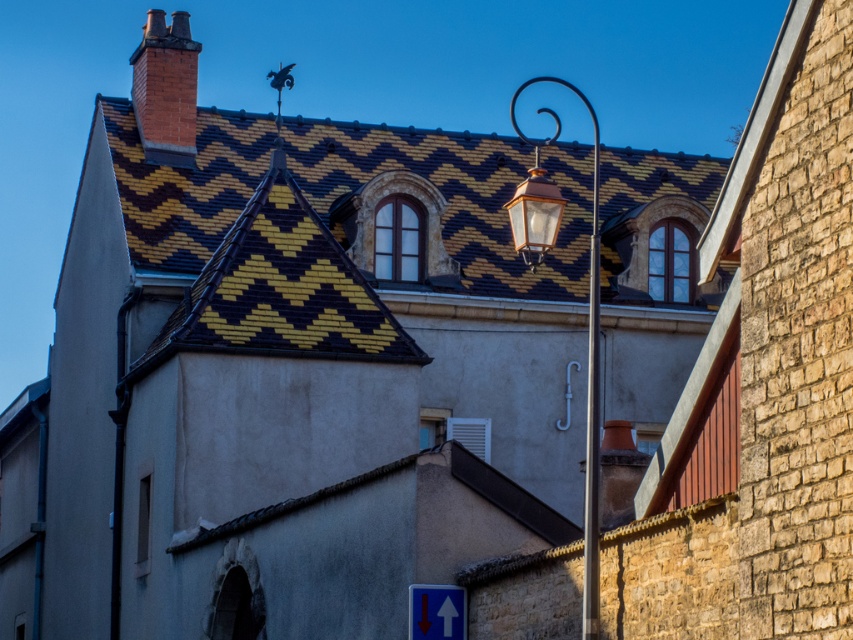
Question: Is matte copper streetlight at center-right positioned behind copper lantern at center?

Choices:
 (A) yes
 (B) no

Answer: (B)

Question: Which object is positioned closest to the blue glossy arrow at lower center?

Choices:
 (A) polished silver pole at center
 (B) copper lantern at center
 (C) matte copper streetlight at center-right

Answer: (A)

Question: Among these points, which one is nearest to the camera?

Choices:
 (A) (434, 600)
 (B) (595, 572)

Answer: (B)

Question: Which point is farther to the camera?

Choices:
 (A) blue glossy arrow at lower center
 (B) matte copper streetlight at center-right

Answer: (A)

Question: Does matte copper streetlight at center-right appear under copper lantern at center?

Choices:
 (A) yes
 (B) no

Answer: (B)

Question: Is polished silver pole at center to the left of copper lantern at center from the viewer's perspective?

Choices:
 (A) yes
 (B) no

Answer: (B)